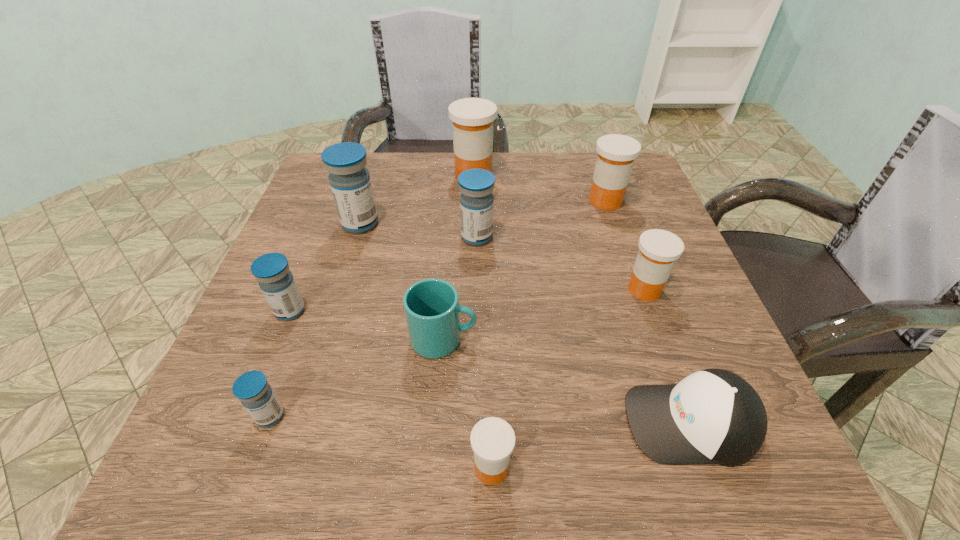
Where is `the nearest blue medicine`? the nearest blue medicine is located at coordinates (252, 389).

What are the coordinates of `the nearest medicine` in the screenshot? It's located at (492, 439).

Image resolution: width=960 pixels, height=540 pixels. Identify the location of the nearest orange medicine. (492, 439).

Identify the location of vacant space located on the label of the biggest orange medicine. The width and height of the screenshot is (960, 540). (564, 174).

Where is `vacant space situated 0.310m on the right of the biggest blue medicine`? The width and height of the screenshot is (960, 540). vacant space situated 0.310m on the right of the biggest blue medicine is located at coordinates (516, 224).

You are a GUI agent. You are given a task and a screenshot of the screen. Output one action in this format:
    pyautogui.click(x=<x>, y=<y>)
    Task: Click on the vacant space situated on the label of the second biggest orange medicine
    The width and height of the screenshot is (960, 540).
    Given the screenshot: What is the action you would take?
    pyautogui.click(x=520, y=201)

Locate an element on the screen. This screenshot has width=960, height=540. free space located on the label of the second biggest orange medicine is located at coordinates (492, 201).

I want to click on vacant space located 0.390m on the label of the second biggest orange medicine, so click(425, 201).

Find the location of `vacant point located 0.310m on the front of the rightmost blue medicine`. vacant point located 0.310m on the front of the rightmost blue medicine is located at coordinates (476, 372).

At what (x,y) coordinates should I click in order to perform the action: click on vacant space situated on the label of the second smallest orange medicine. Please return your answer as a coordinate pair (x, y). This screenshot has height=540, width=960. Looking at the image, I should click on (436, 289).